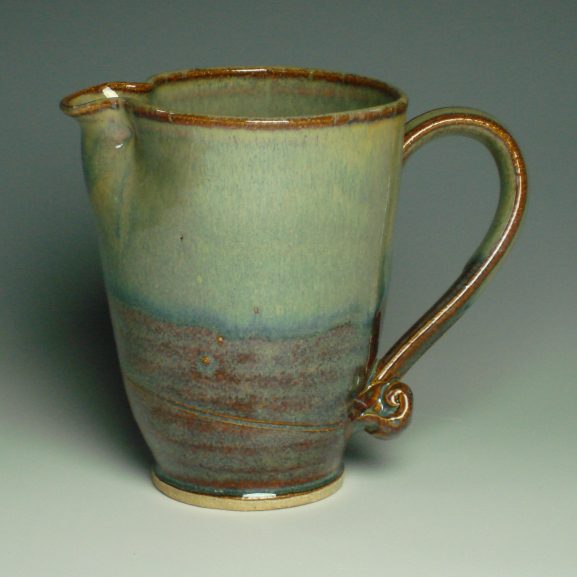
Where is `cup`? cup is located at coordinates (213, 363).